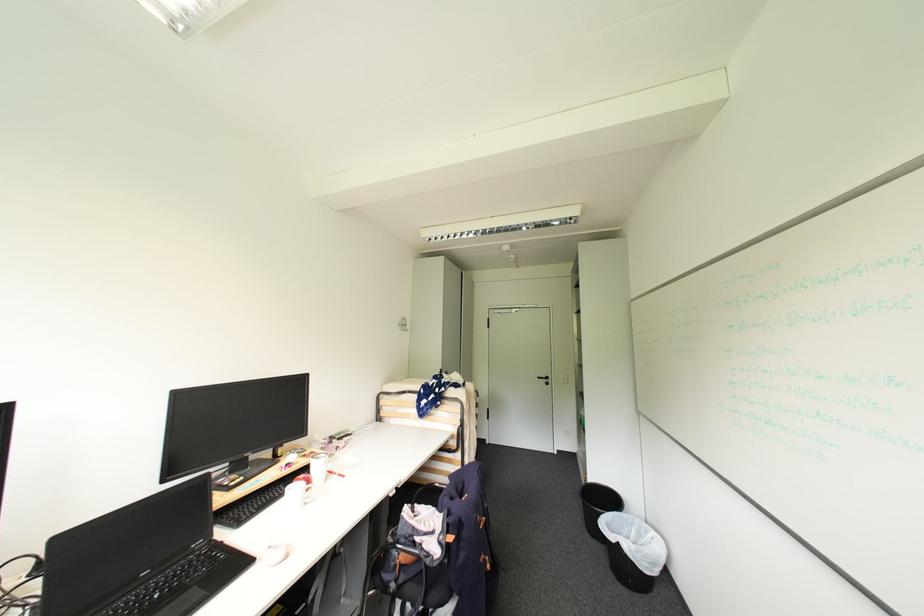
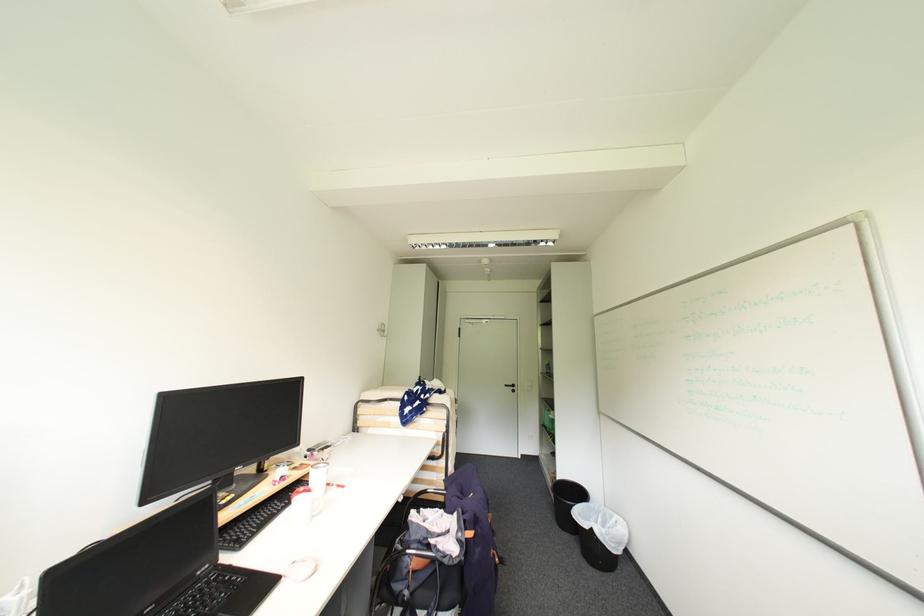
In the second image, find the point that corresponds to point (397, 496) in the first image.

(407, 501)